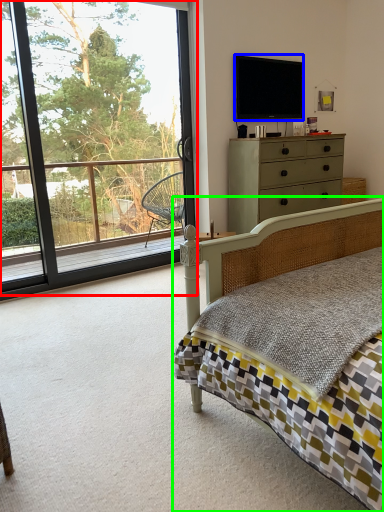
Question: Considering the real-world distances, which object is closest to window (highlighted by a red box)? television (highlighted by a blue box) or bed (highlighted by a green box).

Choices:
 (A) television
 (B) bed

Answer: (A)